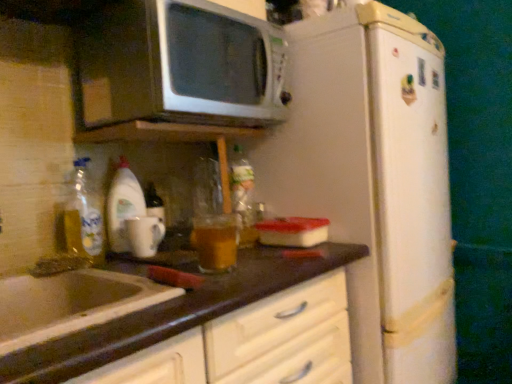
Question: Is the depth of translucent plastic bottle at center greater than that of white matte refrigerator at center-right?

Choices:
 (A) yes
 (B) no

Answer: (A)

Question: Is white matte refrigerator at center-right at the back of translucent plastic bottle at center?

Choices:
 (A) yes
 (B) no

Answer: (B)

Question: Does translucent plastic bottle at center have a smaller size compared to white matte refrigerator at center-right?

Choices:
 (A) no
 (B) yes

Answer: (B)

Question: Could you tell me if translucent plastic bottle at center is turned towards white matte refrigerator at center-right?

Choices:
 (A) yes
 (B) no

Answer: (B)

Question: Is translucent plastic bottle at center next to white matte refrigerator at center-right?

Choices:
 (A) no
 (B) yes

Answer: (A)

Question: Is point (216, 289) positioned closer to the camera than point (128, 177)?

Choices:
 (A) closer
 (B) farther

Answer: (A)

Question: Relative to translucent glass mug at left, is brown laminate countertop at lower center in front or behind?

Choices:
 (A) behind
 (B) front

Answer: (B)

Question: Would you say brown laminate countertop at lower center is to the left or to the right of translucent glass mug at left in the picture?

Choices:
 (A) left
 (B) right

Answer: (B)

Question: From the image's perspective, is brown laminate countertop at lower center above or below translucent glass mug at left?

Choices:
 (A) above
 (B) below

Answer: (B)

Question: Considering the positions of white matte refrigerator at center-right and white glossy mug at left in the image, is white matte refrigerator at center-right wider or thinner than white glossy mug at left?

Choices:
 (A) thin
 (B) wide

Answer: (B)

Question: From a real-world perspective, is white matte refrigerator at center-right positioned above or below white glossy mug at left?

Choices:
 (A) above
 (B) below

Answer: (B)

Question: Is point (296, 210) closer or farther from the camera than point (132, 218)?

Choices:
 (A) farther
 (B) closer

Answer: (A)

Question: Is white matte refrigerator at center-right situated inside white glossy mug at left or outside?

Choices:
 (A) inside
 (B) outside

Answer: (B)

Question: In terms of height, does white glossy mug at left look taller or shorter compared to translucent glass mug at left?

Choices:
 (A) short
 (B) tall

Answer: (A)

Question: In the image, is white glossy mug at left on the left side or the right side of translucent glass mug at left?

Choices:
 (A) left
 (B) right

Answer: (B)